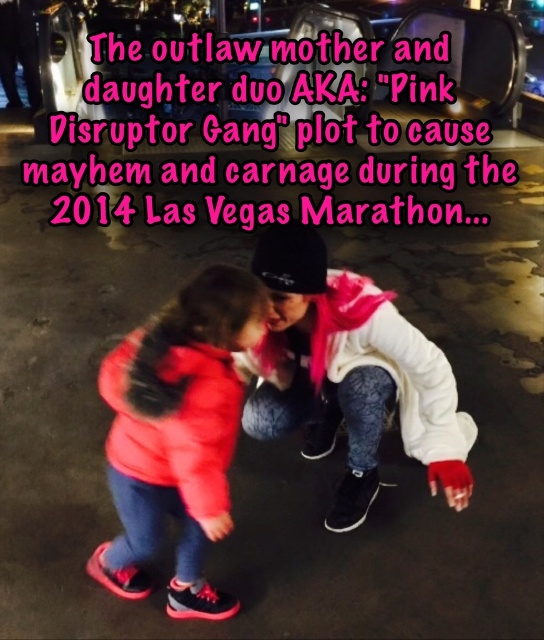
Which is in front, point (342, 346) or point (217, 276)?

Point (217, 276) is more forward.

Does white matte jacket at center come in front of matte red jacket at lower left?

That is False.

The height and width of the screenshot is (640, 544). Describe the element at coordinates (349, 374) in the screenshot. I see `white matte jacket at center` at that location.

Locate an element on the screen. white matte jacket at center is located at coordinates (349, 374).